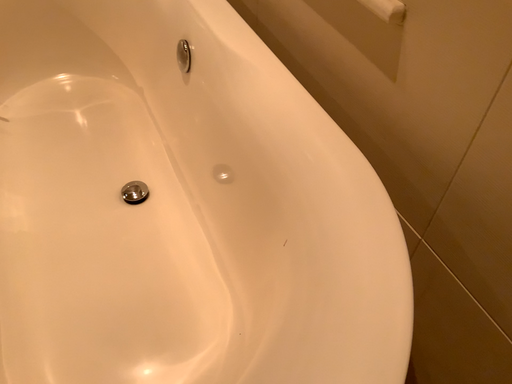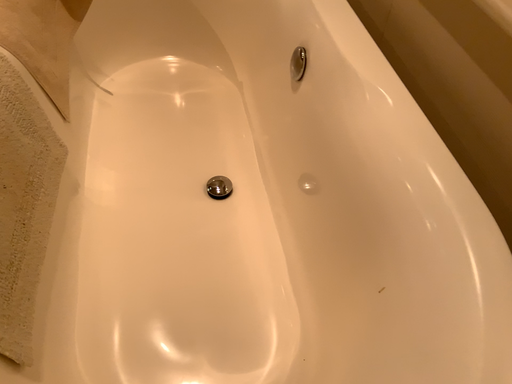
Question: Which way did the camera rotate in the video?

Choices:
 (A) rotated left
 (B) rotated right

Answer: (A)